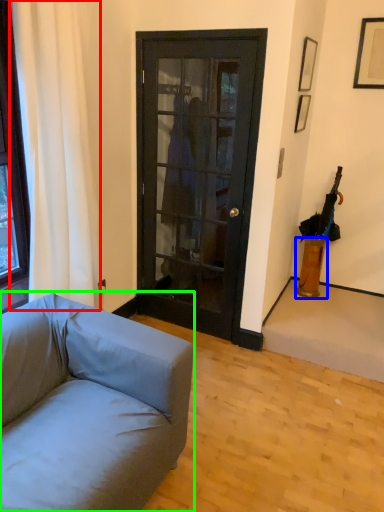
Question: Based on their relative distances, which object is nearer to curtain (highlighted by a red box)? Choose from vase (highlighted by a blue box) and studio couch (highlighted by a green box).

Choices:
 (A) vase
 (B) studio couch

Answer: (B)